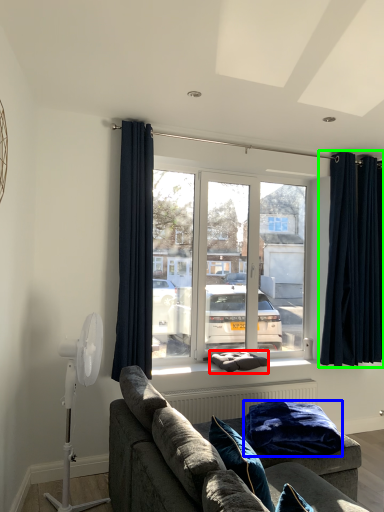
Question: Considering the real-world distances, which object is farthest from pillow (highlighted by a red box)? blanket (highlighted by a blue box) or curtain (highlighted by a green box)?

Choices:
 (A) blanket
 (B) curtain

Answer: (B)